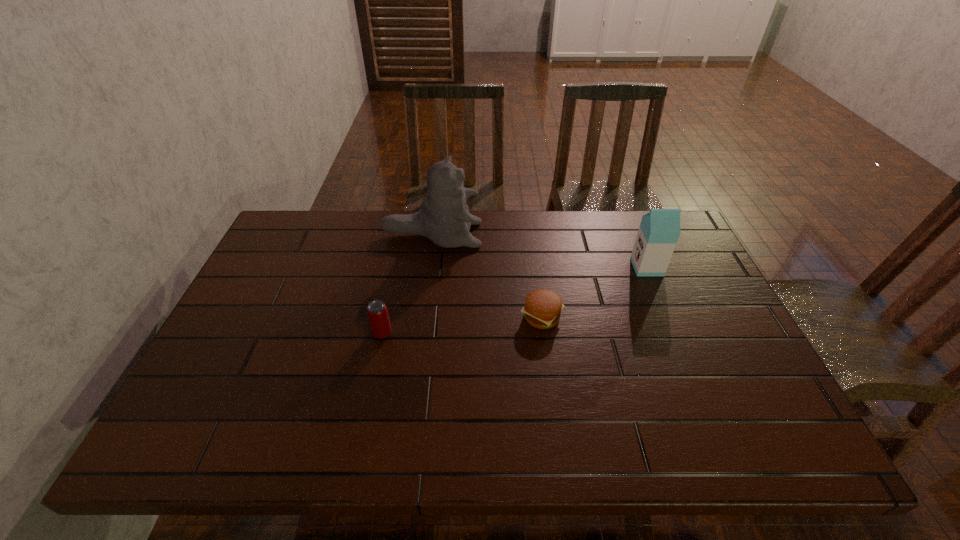
Find the location of `free space between the hamburger and the farthest object`. free space between the hamburger and the farthest object is located at coordinates (487, 276).

You are a GUI agent. You are given a task and a screenshot of the screen. Output one action in this format:
    pyautogui.click(x=<x>, y=<y>)
    Task: Click on the empty location between the third tallest object and the hamburger
    The height and width of the screenshot is (540, 960).
    Given the screenshot: What is the action you would take?
    pyautogui.click(x=462, y=325)

Identify the location of empty location between the beer can and the farthest object. (407, 284).

The height and width of the screenshot is (540, 960). Identify the location of free area in between the beer can and the hamburger. (462, 325).

Find the location of a particular element. This screenshot has width=960, height=540. unoccupied area between the tallest object and the second object from right to left is located at coordinates (487, 276).

Locate an element on the screen. The width and height of the screenshot is (960, 540). free spot between the second shortest object and the shortest object is located at coordinates (462, 325).

The image size is (960, 540). Find the location of `free space between the milk carton and the cat`. free space between the milk carton and the cat is located at coordinates (540, 251).

Locate an element on the screen. unoccupied position between the cat and the rightmost object is located at coordinates (540, 251).

What are the coordinates of `object that ranks as the third closest to the hamburger` in the screenshot? It's located at (377, 312).

Locate which object is the closest to the beer can. Please provide its 2D coordinates. Your answer should be formatted as a tuple, i.e. [(x, y)], where the tuple contains the x and y coordinates of a point satisfying the conditions above.

[(444, 218)]